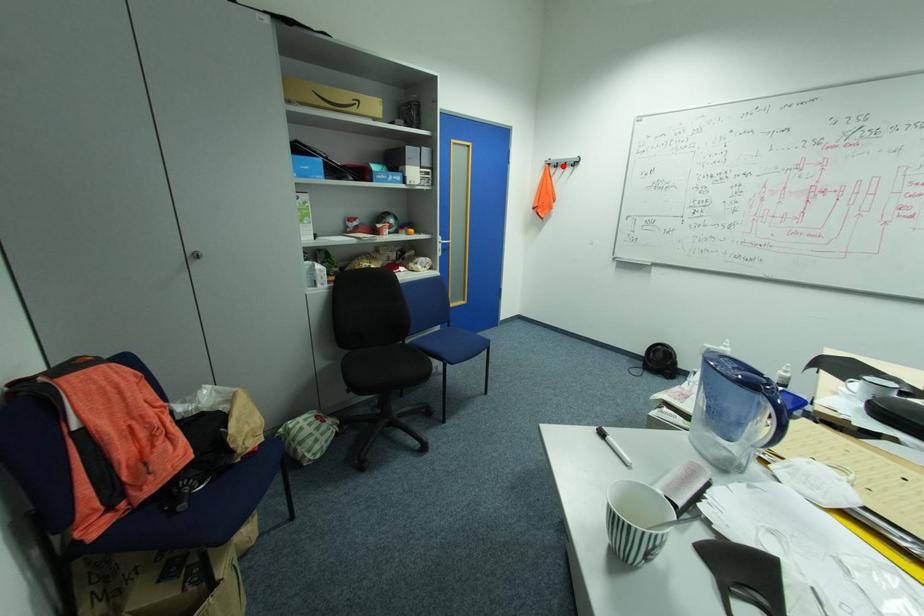
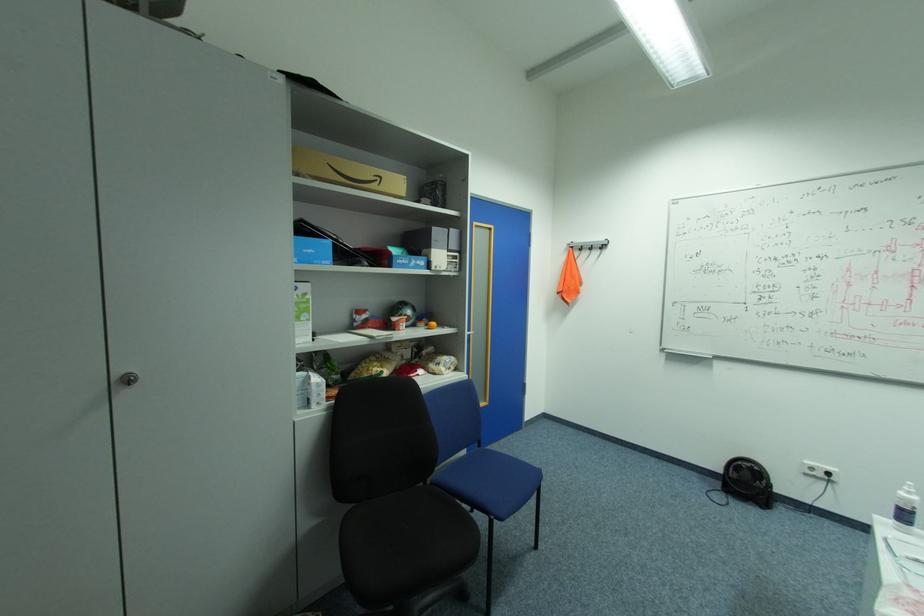
The point at the highlighted location is marked in the first image. Where is the corresponding point in the second image?

(588, 249)